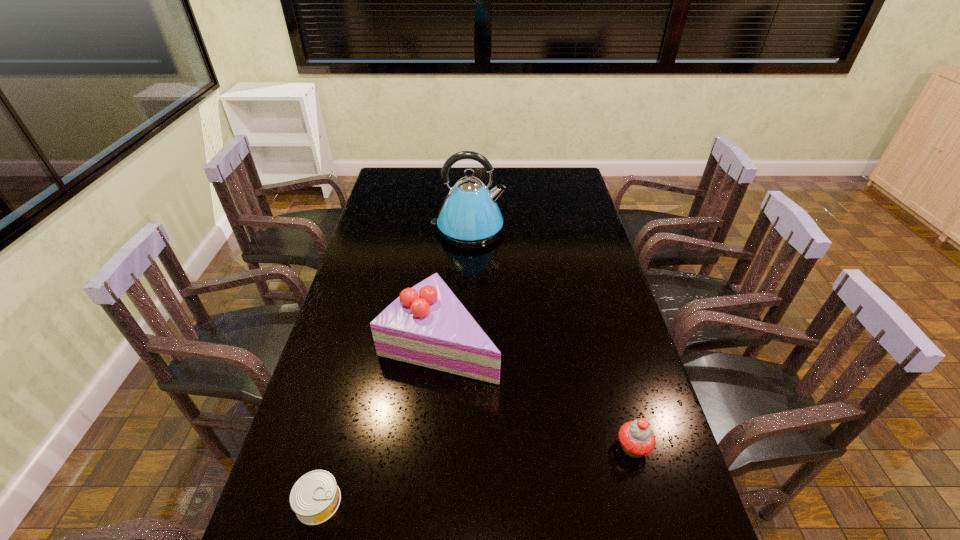
The width and height of the screenshot is (960, 540). I want to click on vacant region located on the back of the cupcake, so click(x=609, y=358).

Where is `free region located 0.050m on the left of the can`? free region located 0.050m on the left of the can is located at coordinates (274, 502).

Locate an element on the screen. The height and width of the screenshot is (540, 960). cake that is at the left edge is located at coordinates (427, 325).

You are a GUI agent. You are given a task and a screenshot of the screen. Output one action in this format:
    pyautogui.click(x=<x>, y=<y>)
    Task: Click on the can located in the left edge section of the desktop
    
    Given the screenshot: What is the action you would take?
    pyautogui.click(x=315, y=497)

Find the location of `object located in the right edge section of the desktop`. object located in the right edge section of the desktop is located at coordinates (637, 439).

In the image, there is a desktop. At what (x,y) coordinates should I click in order to perform the action: click on blank space at the far edge. Please return your answer as a coordinate pair (x, y). This screenshot has width=960, height=540. Looking at the image, I should click on (527, 190).

Locate an element on the screen. vacant space at the left edge of the desktop is located at coordinates (396, 202).

Find the location of a particular element. The height and width of the screenshot is (540, 960). free spot at the right edge of the desktop is located at coordinates (562, 255).

Locate an element on the screen. unoccupied position between the farthest object and the nearest object is located at coordinates (394, 366).

You are a GUI agent. You are given a task and a screenshot of the screen. Output one action in this format:
    pyautogui.click(x=<x>, y=<y>)
    Task: Click on the empty space that is in between the cake and the rightmost object
    
    Given the screenshot: What is the action you would take?
    pyautogui.click(x=536, y=394)